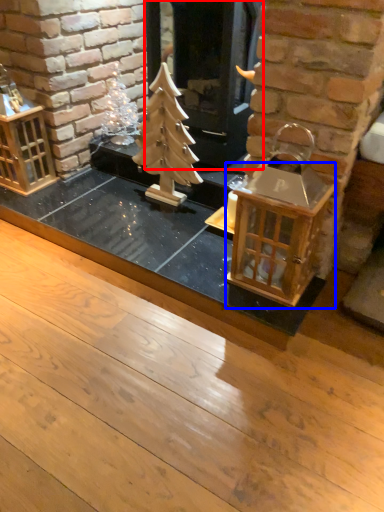
Question: Which of the following is the closest to the observer, fireplace (highlighted by a red box) or table (highlighted by a blue box)?

Choices:
 (A) fireplace
 (B) table

Answer: (B)